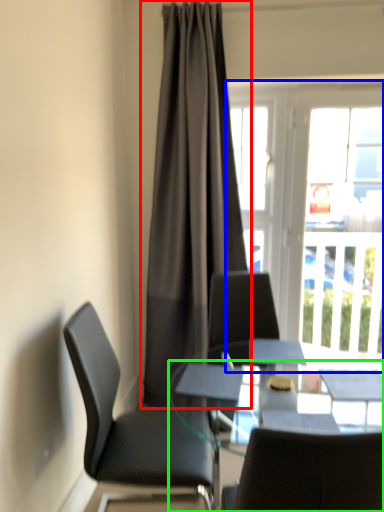
Question: Which is farther away from curtain (highlighted by a red box)? window (highlighted by a blue box) or desk (highlighted by a green box)?

Choices:
 (A) window
 (B) desk

Answer: (B)